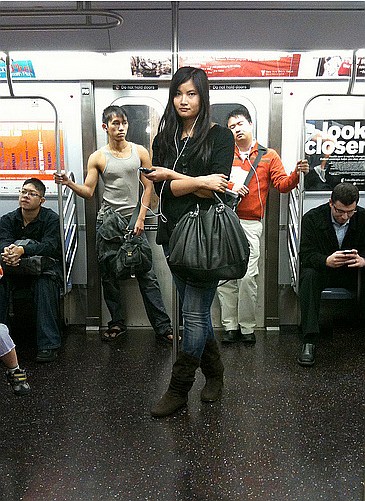
Locate an element on the screen. phones is located at coordinates (143, 169), (347, 247).